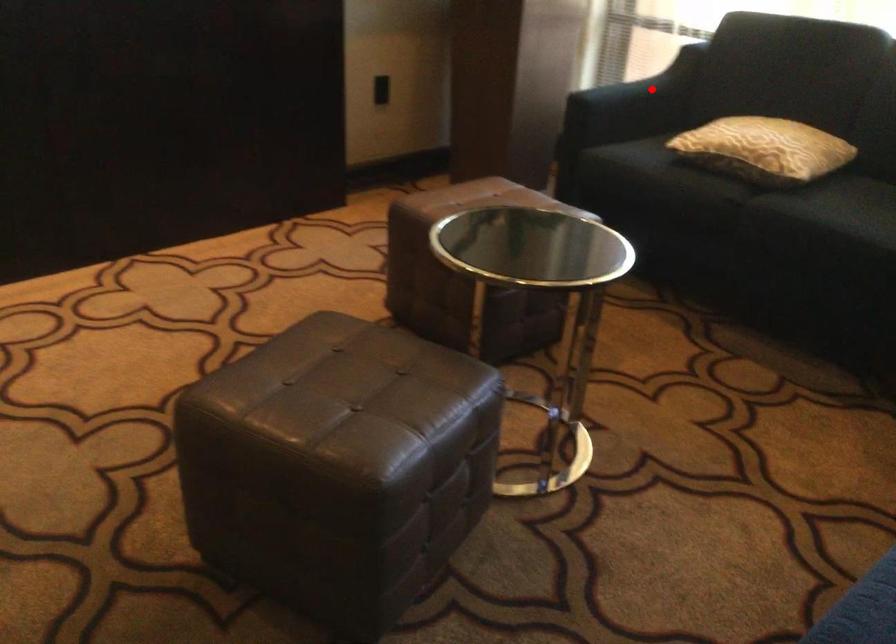
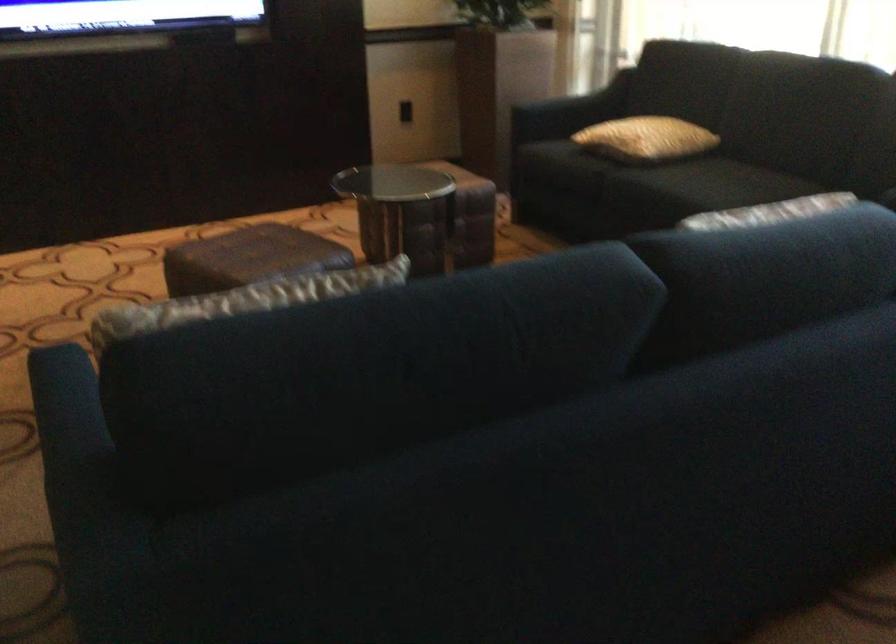
Question: I am providing you with two images of the same scene from different viewpoints. Image1 has a red point marked. In image2, the corresponding 3D location appears at what relative position? Reply with the corresponding letter.

Choices:
 (A) Closer
 (B) Farther

Answer: (B)